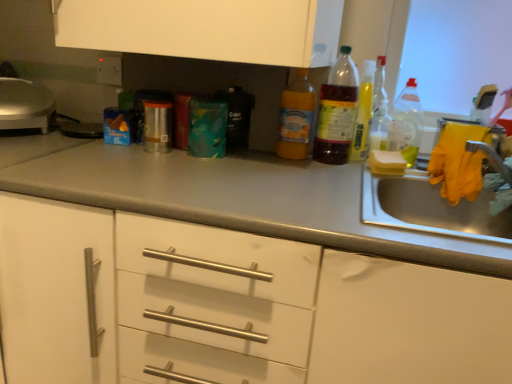
At what (x,y) coordinates should I click in order to perform the action: click on vacant space situated on the left part of translucent plastic bottle at center, which ranks as the fourth bottle in right-to-left order. Please return your answer as a coordinate pair (x, y). Looking at the image, I should click on (273, 153).